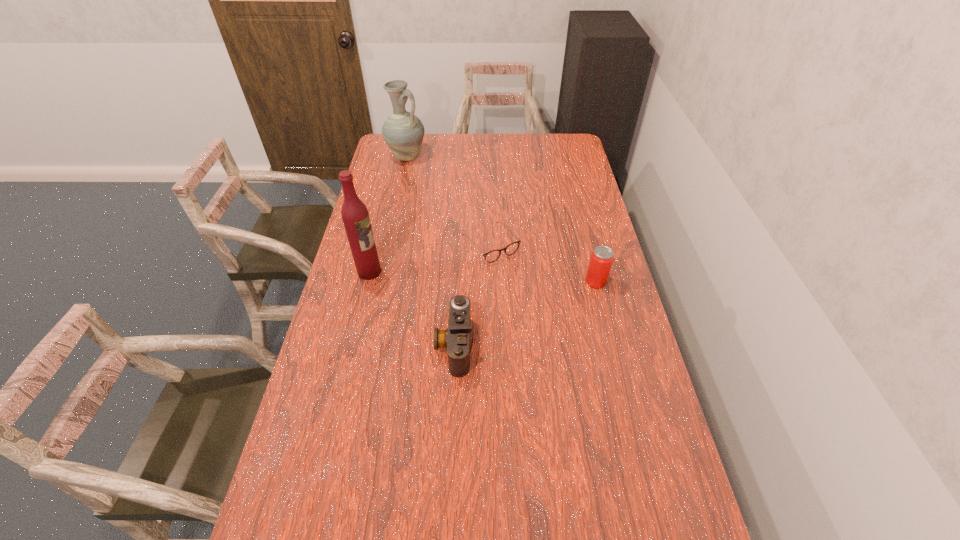
This screenshot has width=960, height=540. What are the coordinates of `vacant space located on the label of the liquor` in the screenshot? It's located at (427, 283).

Identify the location of object present at the far edge. (403, 132).

This screenshot has height=540, width=960. In order to click on pitcher that is at the left edge in this screenshot , I will do `click(403, 132)`.

The height and width of the screenshot is (540, 960). I want to click on liquor situated at the left edge, so click(x=355, y=216).

Where is `object at the right edge`? This screenshot has width=960, height=540. object at the right edge is located at coordinates (601, 260).

In order to click on object present at the far left corner in this screenshot , I will do `click(403, 132)`.

Identify the location of vacant space at the far edge of the desktop. The width and height of the screenshot is (960, 540). [x=526, y=139].

The width and height of the screenshot is (960, 540). I want to click on free space at the left edge of the desktop, so click(x=368, y=351).

Find the location of `free location at the right edge of the desktop`. free location at the right edge of the desktop is located at coordinates (576, 282).

Locate an element on the screen. The height and width of the screenshot is (540, 960). blank space at the far right corner of the desktop is located at coordinates (553, 146).